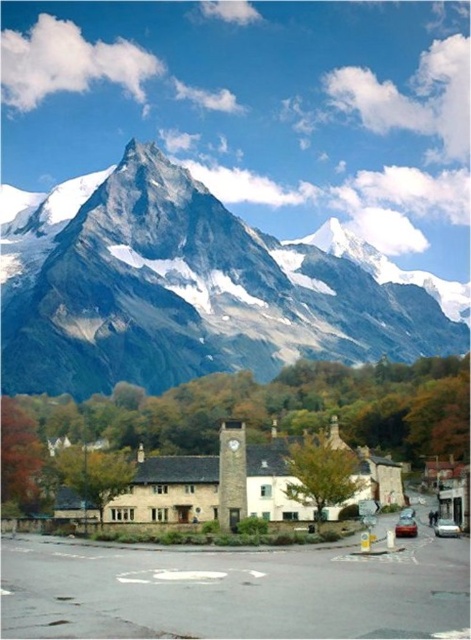
Question: Which object is closer to the camera taking this photo?

Choices:
 (A) rocky gray mountain range at upper center
 (B) metallic red car at center
 (C) smooth stone clock tower at center

Answer: (C)

Question: Which of the following is the closest to the observer?

Choices:
 (A) smooth stone clock tower at center
 (B) rocky gray mountain range at upper center
 (C) silver metallic car at center

Answer: (A)

Question: Can you confirm if rocky gray mountain range at upper center is wider than metallic red car at center?

Choices:
 (A) yes
 (B) no

Answer: (A)

Question: Is rocky gray mountain range at upper center wider than metallic red car at center?

Choices:
 (A) yes
 (B) no

Answer: (A)

Question: Which point appears closest to the camera in this image?

Choices:
 (A) (219, 323)
 (B) (400, 525)

Answer: (B)

Question: Is rocky gray mountain range at upper center to the right of silver metallic car at center from the viewer's perspective?

Choices:
 (A) yes
 (B) no

Answer: (B)